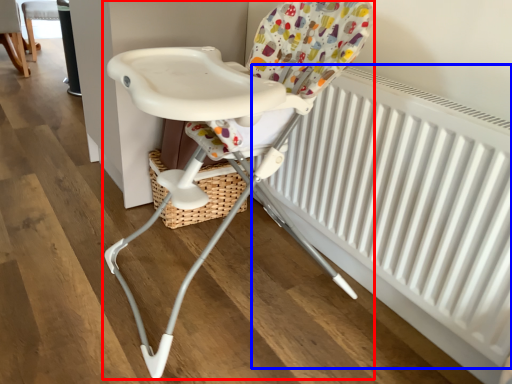
Question: Which object appears farthest to the camera in this image, chair (highlighted by a red box) or radiator (highlighted by a blue box)?

Choices:
 (A) chair
 (B) radiator

Answer: (B)